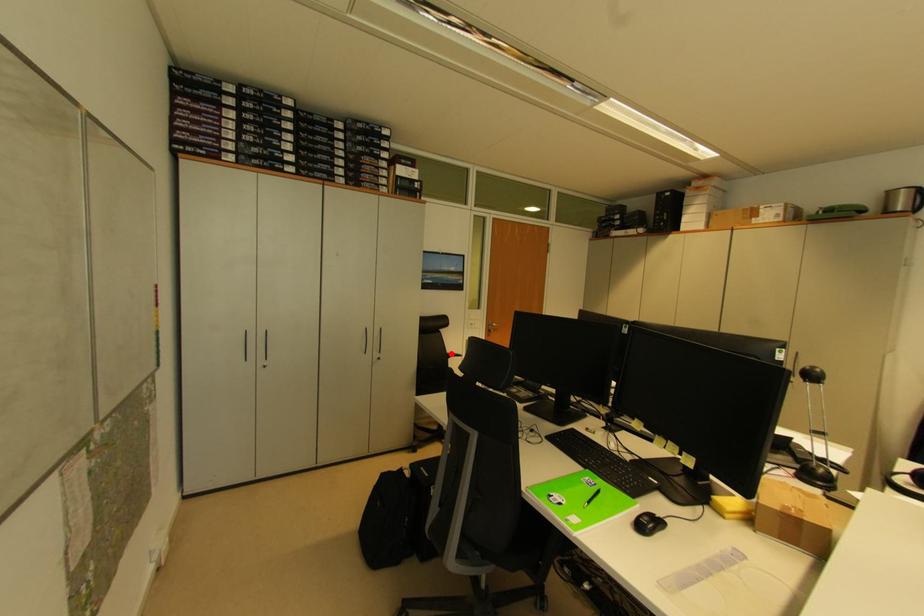
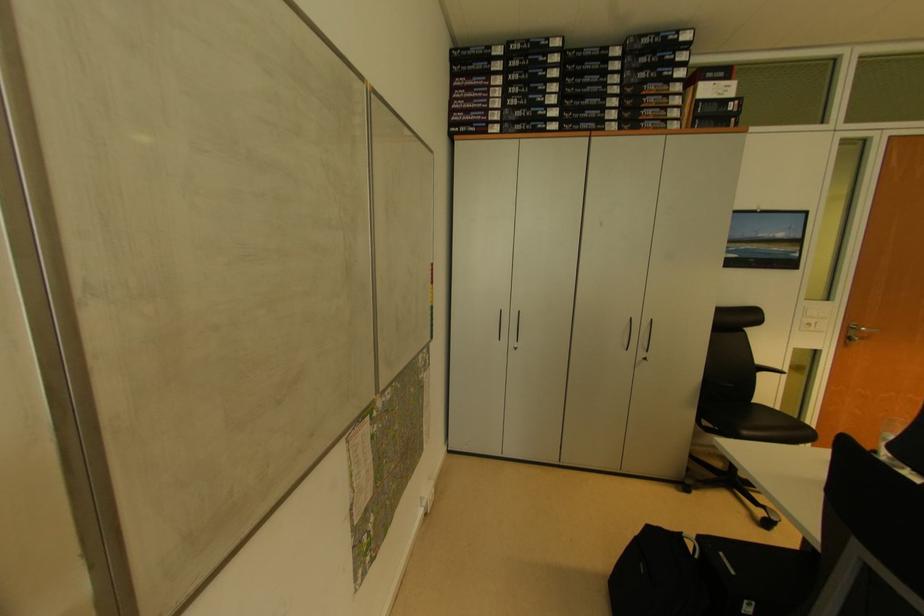
Find the pixel in the second image that matches the highlighted location in the first image.

(761, 363)